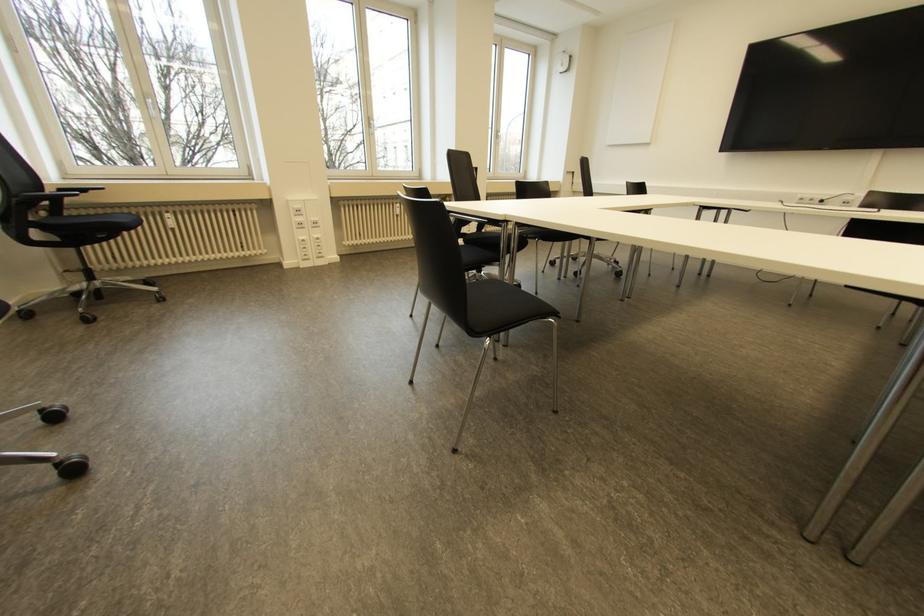
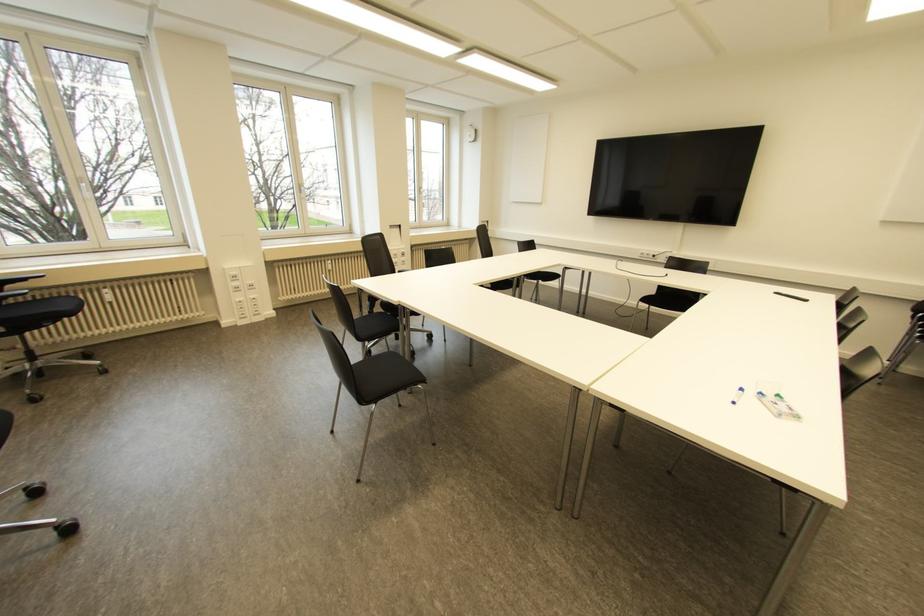
Find the pixel in the second image that matches point 397,211 in the first image.

(330, 267)